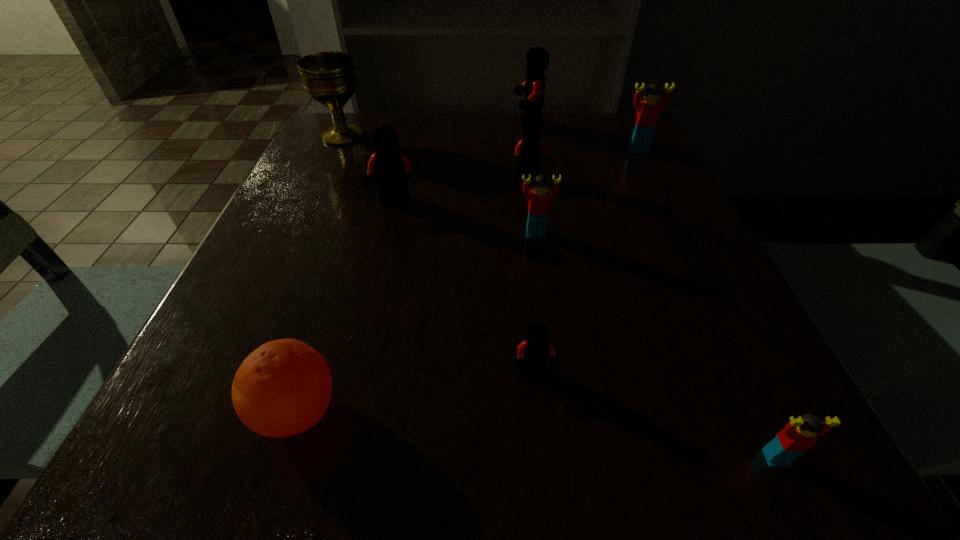
What are the coordinates of `the biggest black Lego` in the screenshot? It's located at (537, 58).

Identify the location of the tallest Lego. (537, 58).

Where is `chalice`? The height and width of the screenshot is (540, 960). chalice is located at coordinates (329, 78).

In order to click on the sixth nearest Lego in this screenshot , I will do `click(648, 110)`.

Where is `the biggest red Lego`? the biggest red Lego is located at coordinates (648, 110).

Identify the location of the fifth nearest object. The height and width of the screenshot is (540, 960). [389, 165].

You are a GUI agent. You are given a task and a screenshot of the screen. Output one action in this format:
    pyautogui.click(x=<x>, y=<y>)
    Task: Click on the leftmost black Lego
    This screenshot has height=540, width=960.
    Given the screenshot: What is the action you would take?
    pyautogui.click(x=389, y=165)

The width and height of the screenshot is (960, 540). What are the coordinates of `the fourth nearest object` in the screenshot? It's located at (539, 197).

Locate an element on the screen. the leftmost red Lego is located at coordinates (539, 197).

Where is `the fifth nearest Lego`? the fifth nearest Lego is located at coordinates (529, 150).